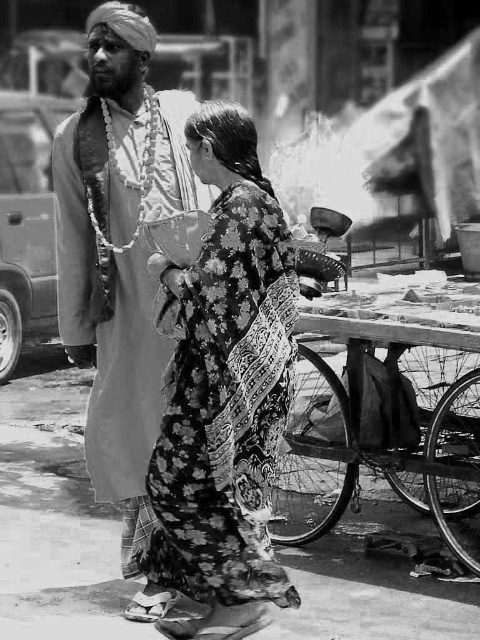
Does floral-patterned fabric at center have a smaller size compared to smooth fabric turban at upper left?

Yes, floral-patterned fabric at center is smaller than smooth fabric turban at upper left.

Is floral-patterned fabric at center positioned in front of smooth fabric turban at upper left?

That is True.

Who is more forward, (193, 410) or (110, 44)?

Point (193, 410) is more forward.

In order to click on floral-patterned fabric at center in this screenshot , I will do `click(225, 392)`.

Who is positioned more to the left, floral-patterned fabric at center or wooden cart at lower right?

From the viewer's perspective, floral-patterned fabric at center appears more on the left side.

Which is behind, point (177, 356) or point (363, 412)?

The point (363, 412) is behind.

The width and height of the screenshot is (480, 640). Identify the location of floral-patterned fabric at center. (225, 392).

This screenshot has width=480, height=640. I want to click on floral-patterned fabric at center, so click(225, 392).

Looking at this image, between smooth fabric turban at upper left and wooden cart at lower right, which one has less height?

Standing shorter between the two is wooden cart at lower right.

Which is above, smooth fabric turban at upper left or wooden cart at lower right?

smooth fabric turban at upper left is above.

Who is more distant from viewer, (x=127, y=237) or (x=451, y=323)?

The point (x=127, y=237) is behind.

What are the coordinates of `smooth fabric turban at upper left` in the screenshot? It's located at pos(119,252).